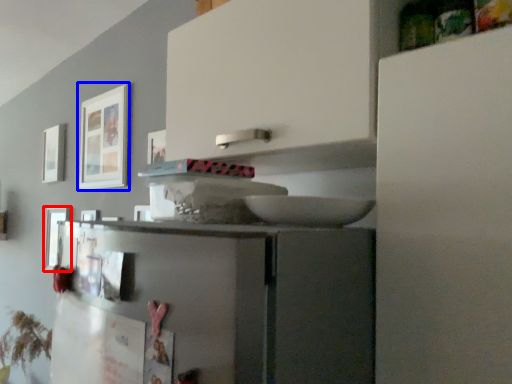
Question: Among these objects, which one is nearest to the camera, picture frame (highlighted by a red box) or picture frame (highlighted by a blue box)?

Choices:
 (A) picture frame
 (B) picture frame

Answer: (B)